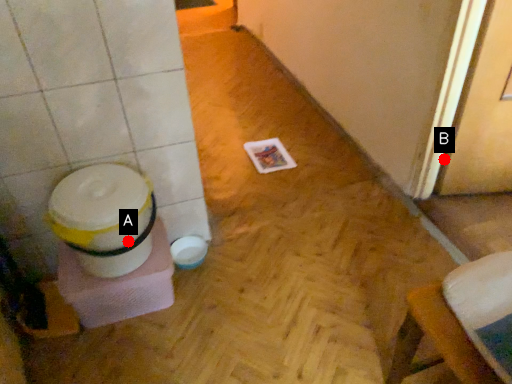
Question: Two points are circled on the image, labeled by A and B beside each circle. Which point is closer to the camera?

Choices:
 (A) A is closer
 (B) B is closer

Answer: (A)